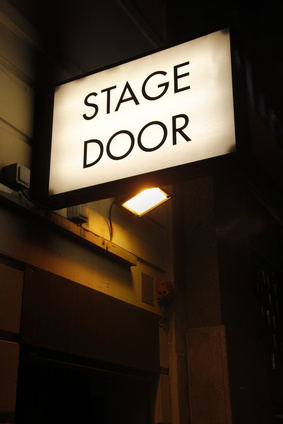
Find the location of a particular element. Image resolution: width=283 pixels, height=424 pixels. light source is located at coordinates pos(145,202).